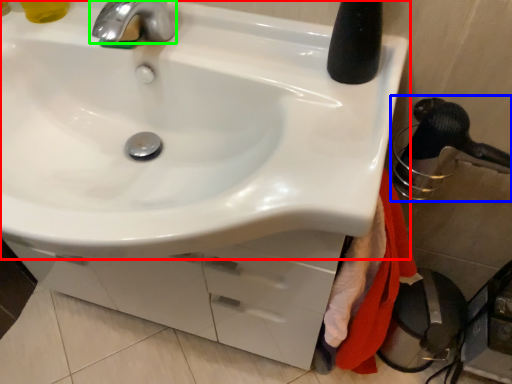
Question: Which is farther away from sink (highlighted by a red box)? shower (highlighted by a blue box) or tap (highlighted by a green box)?

Choices:
 (A) shower
 (B) tap

Answer: (A)